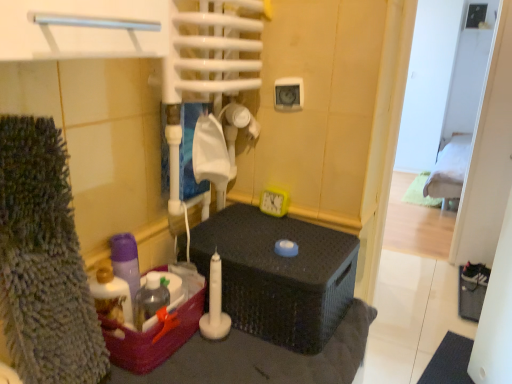
This screenshot has width=512, height=384. Describe the element at coordinates (450, 171) in the screenshot. I see `green fabric bed at upper right` at that location.

Describe the element at coordinates (150, 299) in the screenshot. I see `translucent plastic bottle at lower left` at that location.

The height and width of the screenshot is (384, 512). I want to click on translucent plastic basket at lower left, so click(x=151, y=339).

Could you tell me if translucent plastic bottle at lower left is facing green fabric bed at upper right?

No, translucent plastic bottle at lower left does not turn towards green fabric bed at upper right.

Can you confirm if translucent plastic bottle at lower left is shorter than green fabric bed at upper right?

Yes.

Between point (151, 312) and point (457, 177), which one is positioned behind?

Point (457, 177)

Can you confirm if translucent plastic bottle at lower left is thinner than green fabric bed at upper right?

Correct, the width of translucent plastic bottle at lower left is less than that of green fabric bed at upper right.

Considering the relative sizes of translucent plastic bottle at lower left and translucent plastic basket at lower left in the image provided, is translucent plastic bottle at lower left smaller than translucent plastic basket at lower left?

Yes.

How distant is translucent plastic bottle at lower left from translucent plastic basket at lower left?

translucent plastic bottle at lower left is 2.44 inches away from translucent plastic basket at lower left.

Considering the relative positions of translucent plastic bottle at lower left and translucent plastic basket at lower left in the image provided, is translucent plastic bottle at lower left to the left or to the right of translucent plastic basket at lower left?

From the image, it's evident that translucent plastic bottle at lower left is to the right of translucent plastic basket at lower left.

Is point (169, 299) positioned behind point (115, 348)?

Yes, it is behind point (115, 348).

Looking at this image, from the image's perspective, is matte black wicker basket at center located above translucent plastic basket at lower left?

Yes, from the image's perspective, matte black wicker basket at center is over translucent plastic basket at lower left.

Would you say matte black wicker basket at center is outside translucent plastic basket at lower left?

Indeed, matte black wicker basket at center is completely outside translucent plastic basket at lower left.

From a real-world perspective, does matte black wicker basket at center stand above translucent plastic basket at lower left?

Indeed, from a real-world perspective, matte black wicker basket at center stands above translucent plastic basket at lower left.

Considering the relative positions of matte black wicker basket at center and translucent plastic basket at lower left in the image provided, is matte black wicker basket at center to the left of translucent plastic basket at lower left from the viewer's perspective?

No, matte black wicker basket at center is not to the left of translucent plastic basket at lower left.

Is translucent plastic bottle at lower left completely or partially inside green fabric bed at upper right?

No.

Is green fabric bed at upper right turned away from translucent plastic bottle at lower left?

No, green fabric bed at upper right is not facing the opposite direction of translucent plastic bottle at lower left.

Which is behind, point (461, 137) or point (146, 304)?

The point (461, 137) is more distant.

Is matte black wicker basket at center turned away from green fabric bed at upper right?

Absolutely, matte black wicker basket at center is directed away from green fabric bed at upper right.

From a real-world perspective, is matte black wicker basket at center above or below green fabric bed at upper right?

From a real-world perspective, matte black wicker basket at center is physically above green fabric bed at upper right.

From the image's perspective, which object appears higher, matte black wicker basket at center or green fabric bed at upper right?

green fabric bed at upper right.

In the scene shown: Between matte black wicker basket at center and green fabric bed at upper right, which one has larger width?

With larger width is matte black wicker basket at center.

From a real-world perspective, relative to matte black wicker basket at center, is translucent plastic basket at lower left vertically above or below?

translucent plastic basket at lower left is below matte black wicker basket at center.

Is translucent plastic basket at lower left not close to matte black wicker basket at center?

That's not correct — translucent plastic basket at lower left is a little close to matte black wicker basket at center.

Based on the photo, could you measure the distance between translucent plastic basket at lower left and matte black wicker basket at center?

The distance of translucent plastic basket at lower left from matte black wicker basket at center is 7.91 inches.

Which is behind, translucent plastic basket at lower left or matte black wicker basket at center?

matte black wicker basket at center is more distant.

Is translucent plastic basket at lower left taller than green fabric bed at upper right?

Incorrect, the height of translucent plastic basket at lower left is not larger of that of green fabric bed at upper right.

From a real-world perspective, who is located higher, translucent plastic basket at lower left or green fabric bed at upper right?

translucent plastic basket at lower left, from a real-world perspective.

Could you tell me if translucent plastic basket at lower left is turned towards green fabric bed at upper right?

No, translucent plastic basket at lower left does not turn towards green fabric bed at upper right.

Which of these two, translucent plastic basket at lower left or green fabric bed at upper right, is smaller?

With smaller size is translucent plastic basket at lower left.

You are a GUI agent. You are given a task and a screenshot of the screen. Output one action in this format:
    pyautogui.click(x=<x>, y=<y>)
    Task: Click on the bottle located in front of the green fabric bed at upper right
    This screenshot has width=512, height=384.
    Given the screenshot: What is the action you would take?
    [x=150, y=299]

This screenshot has height=384, width=512. Identify the location of bottle on the right of translucent plastic basket at lower left. (150, 299).

Estimate the real-world distances between objects in this image. Which object is closer to green fabric bed at upper right, matte black wicker basket at center or translucent plastic bottle at lower left?

The object closer to green fabric bed at upper right is matte black wicker basket at center.

From the image, which object appears to be farther from translucent plastic bottle at lower left, matte black wicker basket at center or green fabric bed at upper right?

green fabric bed at upper right lies further to translucent plastic bottle at lower left than the other object.

Considering their positions, is matte black wicker basket at center positioned further to green fabric bed at upper right than translucent plastic basket at lower left?

Based on the image, translucent plastic basket at lower left appears to be further to green fabric bed at upper right.

Looking at the image, which one is located closer to translucent plastic bottle at lower left, translucent plastic basket at lower left or matte black wicker basket at center?

The object closer to translucent plastic bottle at lower left is translucent plastic basket at lower left.

Looking at the image, which one is located further to matte black wicker basket at center, translucent plastic bottle at lower left or translucent plastic basket at lower left?

Based on the image, translucent plastic bottle at lower left appears to be further to matte black wicker basket at center.

Looking at the image, which one is located closer to matte black wicker basket at center, green fabric bed at upper right or translucent plastic basket at lower left?

translucent plastic basket at lower left.

Which object lies nearer to the anchor point translucent plastic basket at lower left, matte black wicker basket at center or green fabric bed at upper right?

matte black wicker basket at center lies closer to translucent plastic basket at lower left than the other object.

Estimate the real-world distances between objects in this image. Which object is closer to matte black wicker basket at center, green fabric bed at upper right or translucent plastic bottle at lower left?

Among the two, translucent plastic bottle at lower left is located nearer to matte black wicker basket at center.

At what (x,y) coordinates should I click in order to perform the action: click on furniture positioned between translucent plastic bottle at lower left and green fabric bed at upper right from near to far. Please return your answer as a coordinate pair (x, y). The image size is (512, 384). Looking at the image, I should click on (279, 275).

You are a GUI agent. You are given a task and a screenshot of the screen. Output one action in this format:
    pyautogui.click(x=<x>, y=<y>)
    Task: Click on the bottle between translucent plastic basket at lower left and green fabric bed at upper right along the z-axis
    
    Given the screenshot: What is the action you would take?
    pyautogui.click(x=150, y=299)

Locate an element on the screen. The image size is (512, 384). bottle between translucent plastic basket at lower left and matte black wicker basket at center in the horizontal direction is located at coordinates (150, 299).

Locate an element on the screen. furniture located between translucent plastic basket at lower left and green fabric bed at upper right in the depth direction is located at coordinates (279, 275).